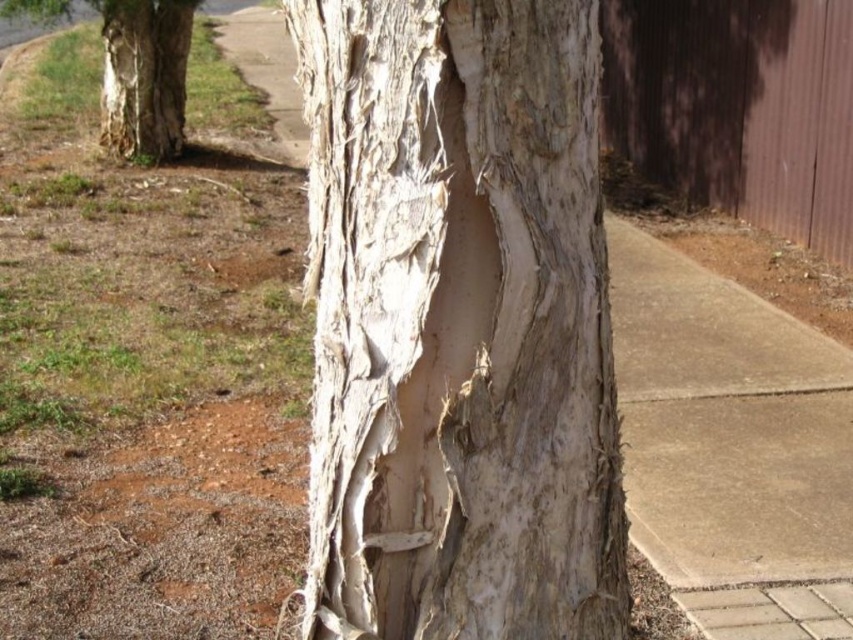
Question: Can you confirm if white textured bark at center is positioned to the right of white textured bark at left?

Choices:
 (A) yes
 (B) no

Answer: (A)

Question: Among these points, which one is nearest to the camera?

Choices:
 (A) (575, 132)
 (B) (122, 1)

Answer: (A)

Question: Does white textured bark at center have a larger size compared to white textured bark at left?

Choices:
 (A) yes
 (B) no

Answer: (B)

Question: Which point is closer to the camera?

Choices:
 (A) white textured bark at center
 (B) white textured bark at left

Answer: (A)

Question: Among these objects, which one is farthest from the camera?

Choices:
 (A) white textured bark at left
 (B) white textured bark at center

Answer: (A)

Question: Is the position of white textured bark at center more distant than that of white textured bark at left?

Choices:
 (A) yes
 (B) no

Answer: (B)